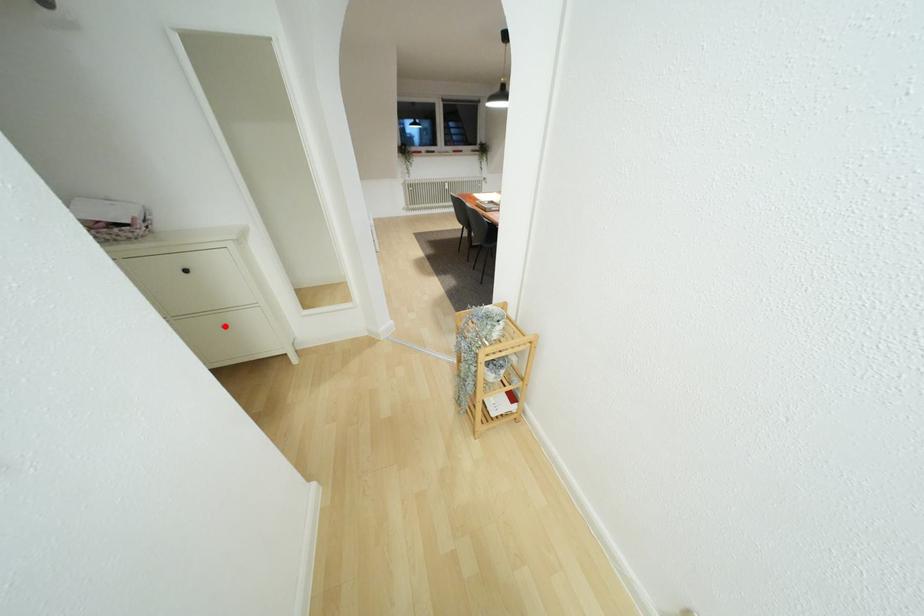
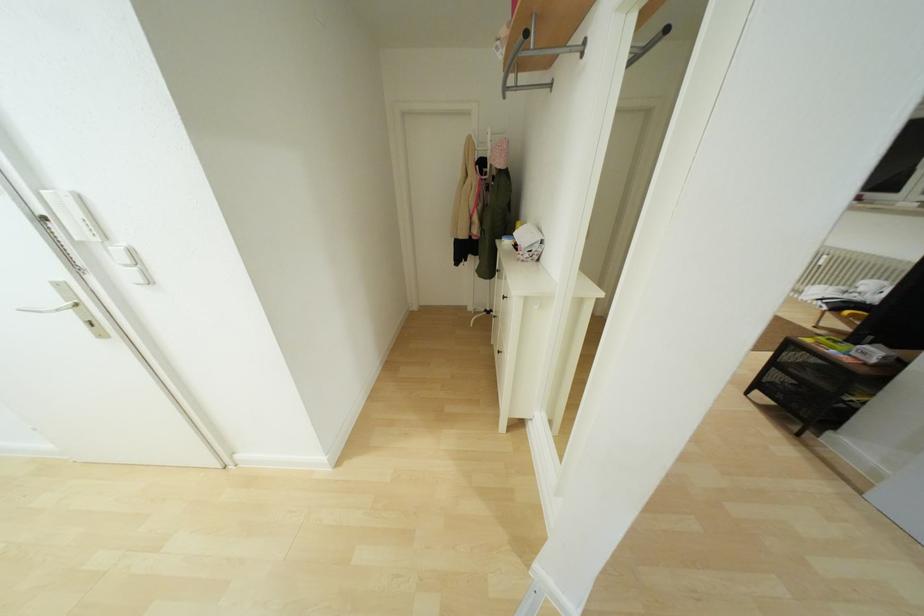
Locate, in the second image, the point that corresponds to the highlighted location in the first image.

(497, 352)